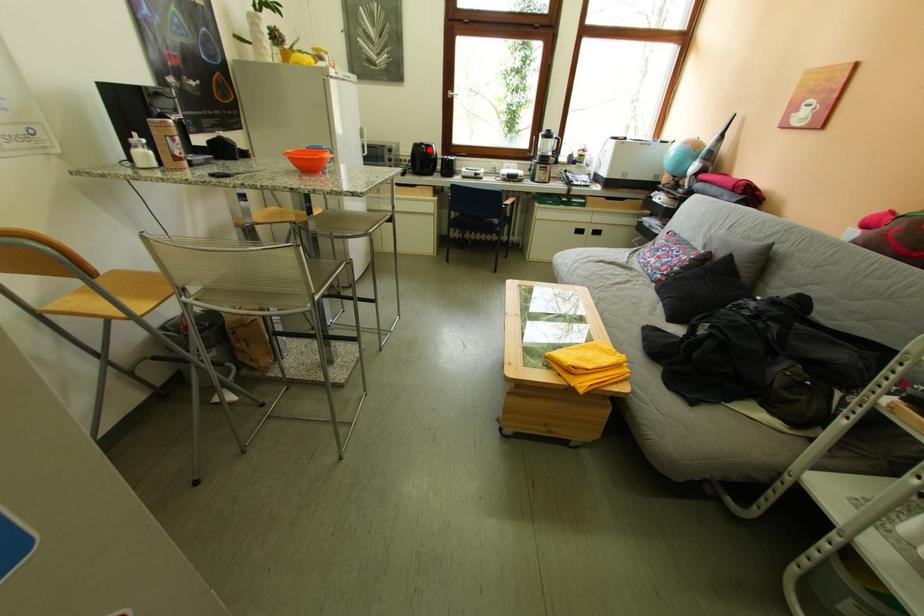
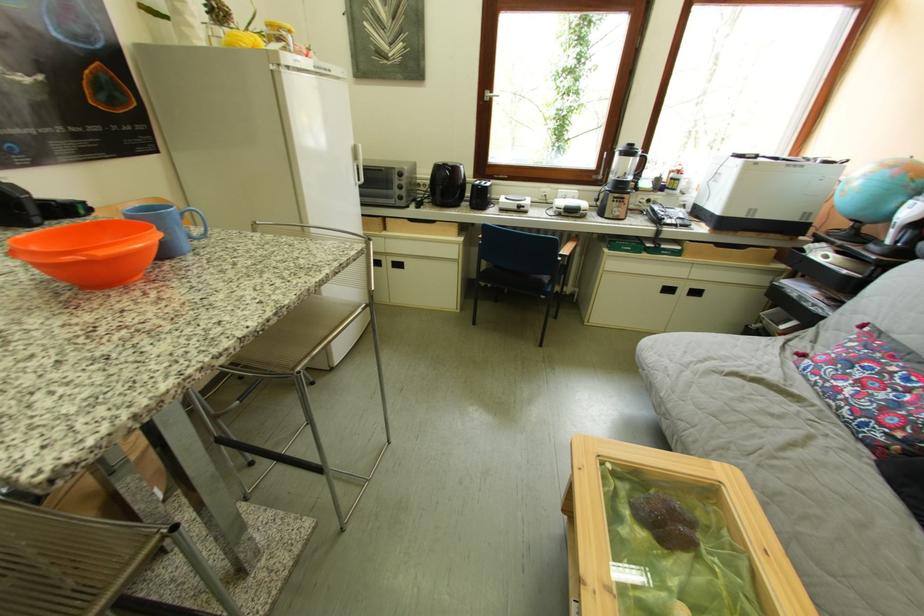
Question: I am providing you with two images of the same scene from different viewpoints. Image1 has a red point marked. In image2, the corresponding 3D location appears at what relative position? Reply with the corresponding letter.

Choices:
 (A) Closer
 (B) Farther

Answer: (B)